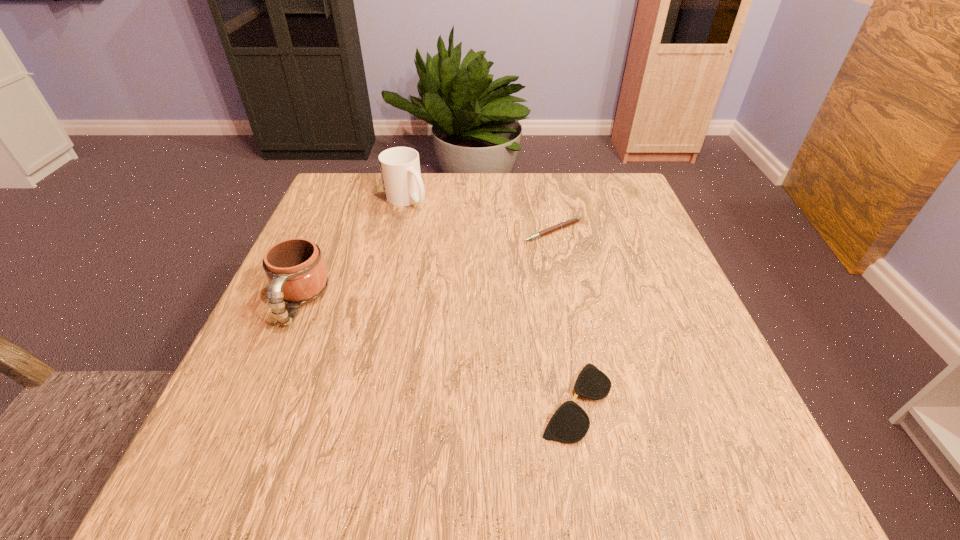
The height and width of the screenshot is (540, 960). Identify the location of vacant area situated at the nib of the second shortest object. (563, 278).

The width and height of the screenshot is (960, 540). Identify the location of free space located 0.250m on the back of the shortest object. (552, 269).

Image resolution: width=960 pixels, height=540 pixels. Find the location of `mug at the far edge`. mug at the far edge is located at coordinates (400, 169).

Find the location of `pen present at the far edge`. pen present at the far edge is located at coordinates (573, 220).

The width and height of the screenshot is (960, 540). I want to click on object that is at the near edge, so click(x=570, y=423).

You are a GUI agent. You are given a task and a screenshot of the screen. Output one action in this format:
    pyautogui.click(x=<x>, y=<y>)
    Task: Click on the object situated at the left edge
    
    Given the screenshot: What is the action you would take?
    pyautogui.click(x=295, y=268)

In the image, there is a desktop. Identify the location of vacant space at the far edge. The height and width of the screenshot is (540, 960). (545, 188).

Locate an element on the screen. vacant space at the near edge of the desktop is located at coordinates (646, 447).

This screenshot has width=960, height=540. In the image, there is a desktop. In order to click on vacant space at the left edge in this screenshot , I will do `click(265, 441)`.

Find the location of a particular element. The width and height of the screenshot is (960, 540). free point at the right edge is located at coordinates (648, 352).